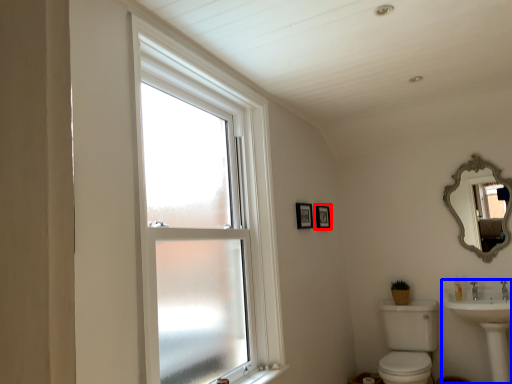
Question: Which of the following is the closest to the observer, picture frame (highlighted by a red box) or sink (highlighted by a blue box)?

Choices:
 (A) picture frame
 (B) sink

Answer: (B)